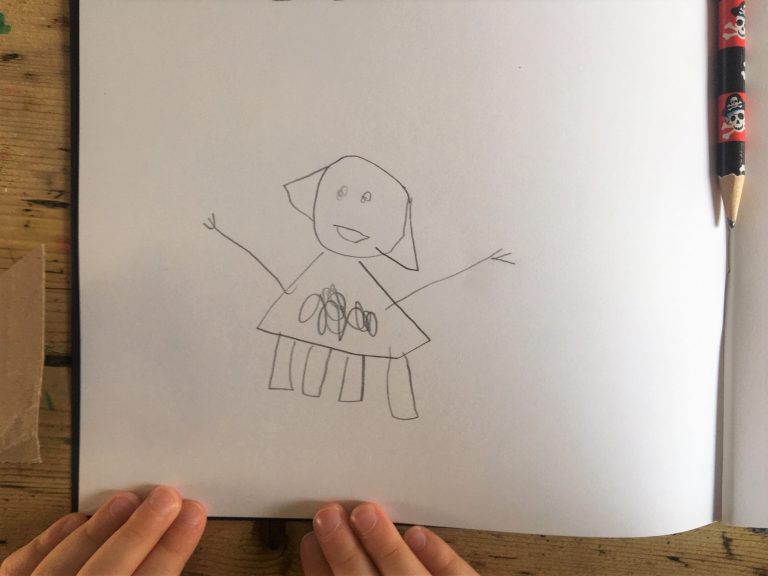
The image size is (768, 576). Find the location of `table`. table is located at coordinates (40, 198).